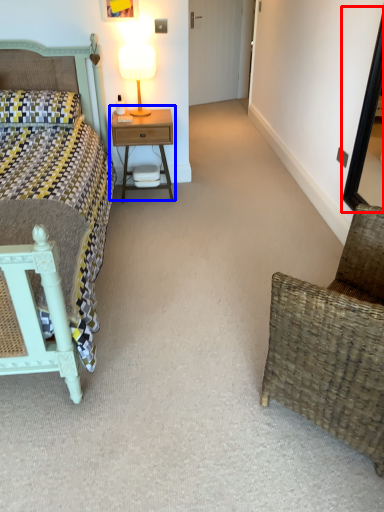
Question: Which of the following is the closest to the observer, mirror (highlighted by a red box) or nightstand (highlighted by a blue box)?

Choices:
 (A) mirror
 (B) nightstand

Answer: (A)